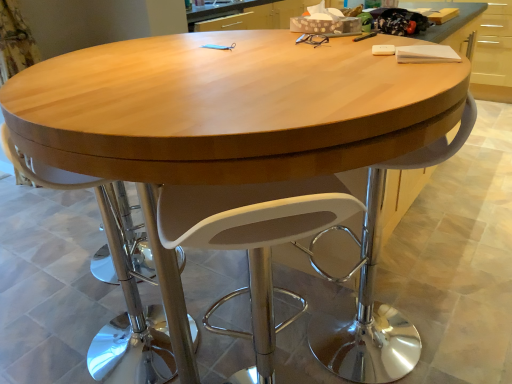
Identify the location of free space behind white plastic chair at center. (143, 289).